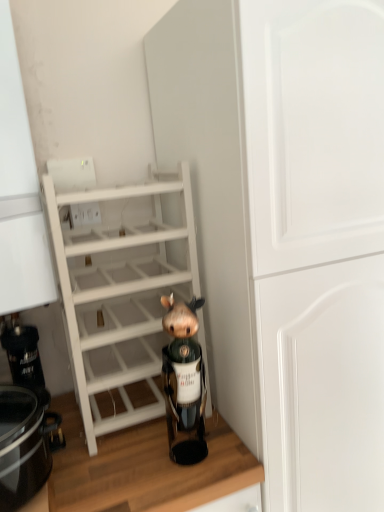
You are a GUI agent. You are given a task and a screenshot of the screen. Output one action in this format:
    pyautogui.click(x=<x>, y=<y>)
    Task: Click on the vacant area situated below black glossy crock pot at lower left (from a real-world perspective)
    The height and width of the screenshot is (512, 384).
    Given the screenshot: What is the action you would take?
    pyautogui.click(x=54, y=487)